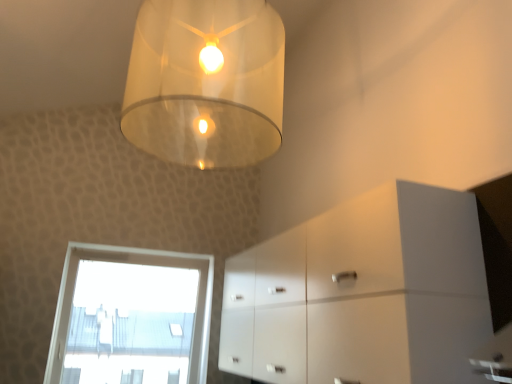
Question: From the image's perspective, is transparent glass window at lower left located above or below white glossy cabinet at lower right?

Choices:
 (A) above
 (B) below

Answer: (B)

Question: Is transparent glass window at lower left wider or thinner than white glossy cabinet at lower right?

Choices:
 (A) thin
 (B) wide

Answer: (A)

Question: Which is nearer to the translucent glass lampshade at upper center?

Choices:
 (A) transparent glass window at lower left
 (B) white glossy cabinet at lower right

Answer: (B)

Question: Considering the real-world distances, which object is closest to the transparent glass window at lower left?

Choices:
 (A) white glossy cabinet at lower right
 (B) translucent glass lampshade at upper center

Answer: (A)